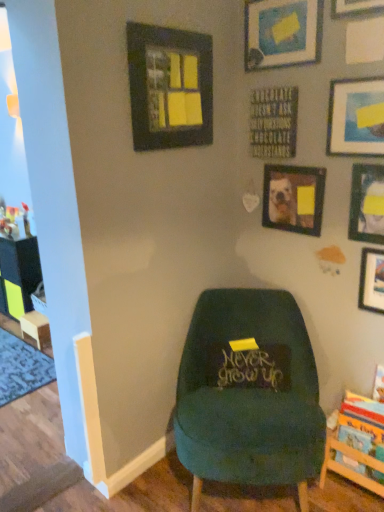
Question: Is point (311, 187) closer or farther from the camera than point (359, 179)?

Choices:
 (A) farther
 (B) closer

Answer: (A)

Question: Is wooden picture frame at center, the 3th picture frame when ordered from left to right, wider or thinner than matte black picture frame at upper right, the 6th picture frame in the left-to-right sequence?

Choices:
 (A) thin
 (B) wide

Answer: (B)

Question: Estimate the real-world distances between objects in this image. Which object is closer to the velvet green chair at center?

Choices:
 (A) matte black picture frame at upper center, the second picture frame from the left
 (B) matte black picture frame at upper right, the 6th picture frame in the left-to-right sequence
 (C) wooden picture frame at center, the 3th picture frame when ordered from left to right
 (D) wooden picture frame at upper right, the 4th picture frame from the left
 (E) matte black sign at center

Answer: (E)

Question: Which object is the closest to the matte white picture frame at upper right, the first picture frame from the right?

Choices:
 (A) wooden bookshelf at lower right
 (B) matte black picture frame at upper center, marked as the sixth picture frame in a right-to-left arrangement
 (C) wooden at left
 (D) wooden picture frame at upper right, the fourth picture frame when ordered from right to left
 (E) wooden picture frame at center, which is the fifth picture frame from right to left

Answer: (E)